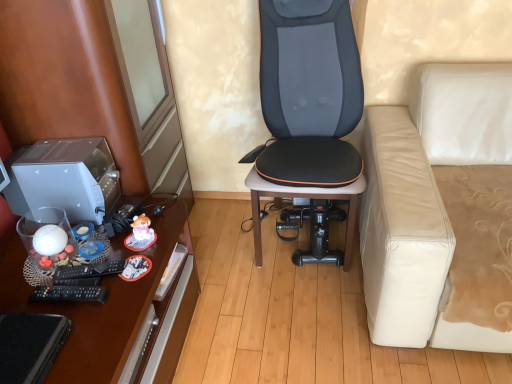
Image resolution: width=512 pixels, height=384 pixels. What are the coordinates of `vacant area situated below black leather chair at center (from a real-world perspective)` in the screenshot? It's located at (287, 236).